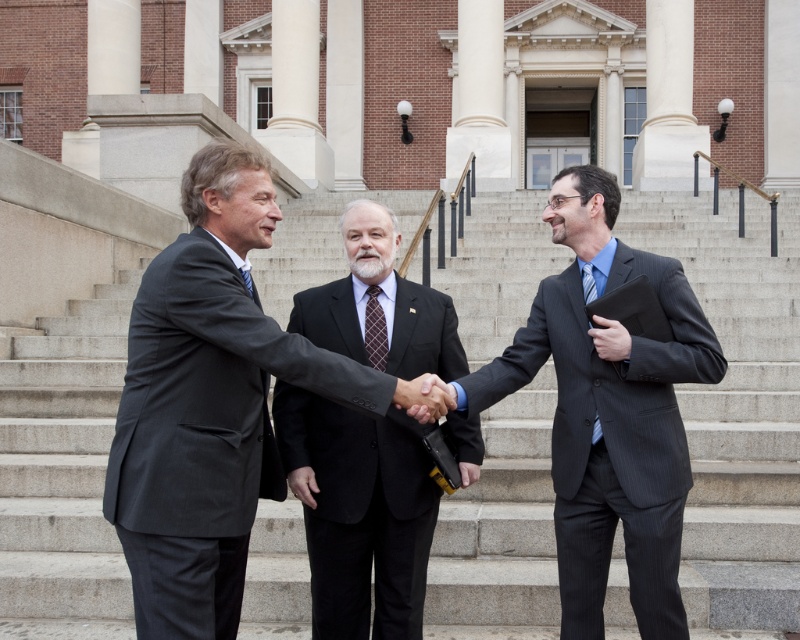
You are standing at the point marked by coordinates point (x=360, y=513) in the image. What object is located exactly at this point?

The point (x=360, y=513) marks the dark gray suit at center.

In the scene described, there are two items of clothing worn by the central figure. The dark gray suit at center and the dark brown textured tie at center. Which one is positioned to the left of the other?

The dark gray suit at center is to the left of dark brown textured tie at center.